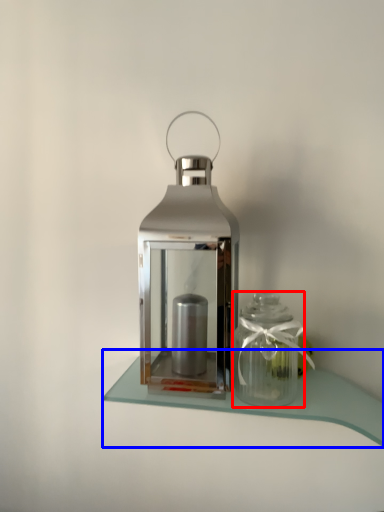
Question: Which of the following is the closest to the observer, glass vase (highlighted by a red box) or table (highlighted by a blue box)?

Choices:
 (A) glass vase
 (B) table

Answer: (B)